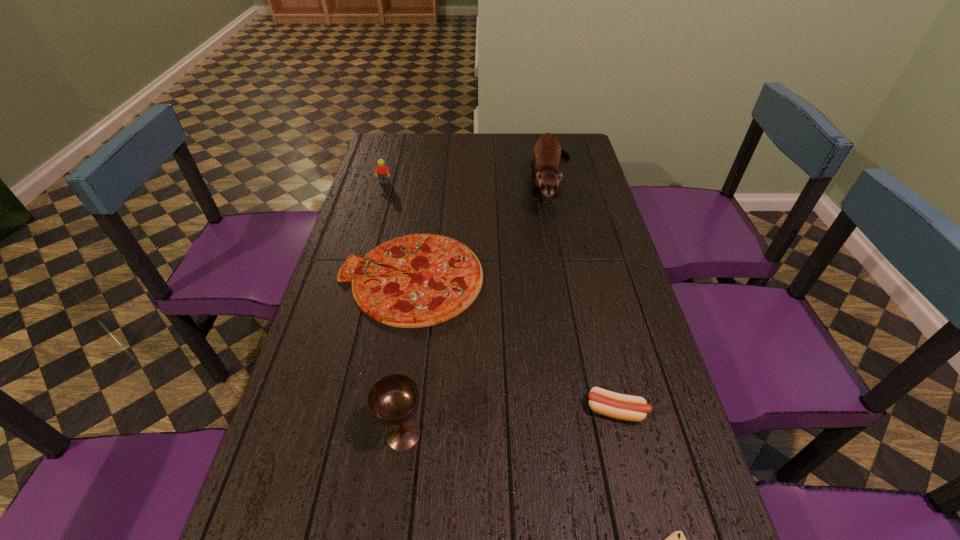
You are a GUI agent. You are given a task and a screenshot of the screen. Output one action in this format:
    pyautogui.click(x=<x>, y=<y>)
    Task: Click on the vacant space positioned on the right of the pizza
    The height and width of the screenshot is (540, 960).
    Given the screenshot: What is the action you would take?
    pyautogui.click(x=602, y=278)

Locate an element on the screen. This screenshot has height=540, width=960. object located in the far edge section of the desktop is located at coordinates (545, 161).

At what (x,y) coordinates should I click in order to perform the action: click on Lego that is at the left edge. Please return your answer as a coordinate pair (x, y). Looking at the image, I should click on (383, 173).

The width and height of the screenshot is (960, 540). Find the location of `pizza that is positioned at the left edge`. pizza that is positioned at the left edge is located at coordinates (444, 277).

Find the location of a particular element. This screenshot has width=960, height=540. ferret present at the right edge is located at coordinates coord(545,161).

This screenshot has width=960, height=540. I want to click on sausage that is at the right edge, so click(625, 407).

Where is `object situated at the far right corner`? The width and height of the screenshot is (960, 540). object situated at the far right corner is located at coordinates (545, 161).

Where is `free location at the far edge of the desktop`? This screenshot has width=960, height=540. free location at the far edge of the desktop is located at coordinates (442, 146).

This screenshot has height=540, width=960. In the image, there is a desktop. Identify the location of free region at the left edge. (360, 350).

Identify the location of vacant position at the right edge of the desktop. (590, 173).